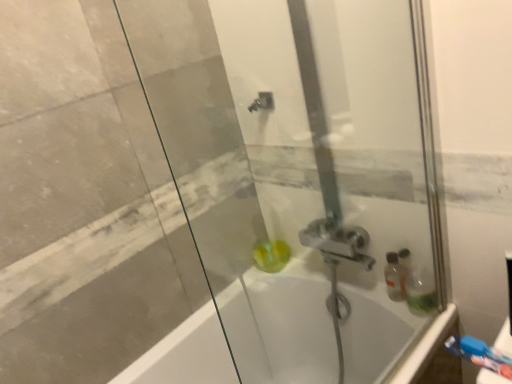
I want to click on white glossy bathtub at center, so click(185, 354).

How different are the orientations of transparent glass shower door at center and white glossy bathtub at center in degrees?

There is a 0.266-degree angle between the facing directions of transparent glass shower door at center and white glossy bathtub at center.

In terms of size, does transparent glass shower door at center appear bigger or smaller than white glossy bathtub at center?

Considering their sizes, transparent glass shower door at center takes up less space than white glossy bathtub at center.

Can you confirm if transparent glass shower door at center is thinner than white glossy bathtub at center?

Yes, transparent glass shower door at center is thinner than white glossy bathtub at center.

From a real-world perspective, is transparent glass shower door at center positioned under white glossy bathtub at center based on gravity?

No.

Is point (271, 267) closer or farther from the camera than point (196, 319)?

Point (271, 267).

Could you tell me if translucent green soap at center is turned towards white glossy bathtub at center?

No.

Is translucent green soap at center located outside white glossy bathtub at center?

Absolutely, translucent green soap at center is external to white glossy bathtub at center.

Is translucent green soap at center wider or thinner than white glossy bathtub at center?

Clearly, translucent green soap at center has less width compared to white glossy bathtub at center.

From the image's perspective, who appears lower, white glossy bathtub at center or translucent green soap at center?

From the image's view, white glossy bathtub at center is below.

From a real-world perspective, relative to translucent green soap at center, is white glossy bathtub at center vertically above or below?

Clearly, from a real-world perspective, white glossy bathtub at center is below translucent green soap at center.

Is white glossy bathtub at center shorter than translucent green soap at center?

Incorrect, the height of white glossy bathtub at center does not fall short of that of translucent green soap at center.

Is white glossy bathtub at center further to the viewer compared to translucent green soap at center?

No, white glossy bathtub at center is in front of translucent green soap at center.

Consider the image. In terms of height, does blue plastic toothbrush at lower right look taller or shorter compared to white glossy bathtub at center?

Clearly, blue plastic toothbrush at lower right is shorter compared to white glossy bathtub at center.

From a real-world perspective, is blue plastic toothbrush at lower right positioned above or below white glossy bathtub at center?

In terms of real-world spatial position, blue plastic toothbrush at lower right is above white glossy bathtub at center.

Which is in front, point (477, 363) or point (210, 363)?

The point (477, 363) is in front.

Is blue plastic toothbrush at lower right with white glossy bathtub at center?

No, blue plastic toothbrush at lower right is not beside white glossy bathtub at center.

From a real-world perspective, which object stands above the other?

From a 3D spatial view, transparent glass shower door at center is above.

Between white glossy bathtub at center and transparent glass shower door at center, which one has smaller width?

transparent glass shower door at center.

Considering the relative positions of white glossy bathtub at center and transparent glass shower door at center in the image provided, is white glossy bathtub at center to the left of transparent glass shower door at center from the viewer's perspective?

Yes, white glossy bathtub at center is to the left of transparent glass shower door at center.

Is white glossy bathtub at center positioned with its back to transparent glass shower door at center?

No, white glossy bathtub at center is not facing away from transparent glass shower door at center.

Does transparent glass shower door at center turn towards blue plastic toothbrush at lower right?

Yes, transparent glass shower door at center is aimed at blue plastic toothbrush at lower right.

Choose the correct answer: Is transparent glass shower door at center inside blue plastic toothbrush at lower right or outside it?

transparent glass shower door at center is not inside blue plastic toothbrush at lower right, it's outside.

Looking at this image, can you tell me how much transparent glass shower door at center and blue plastic toothbrush at lower right differ in facing direction?

The angular difference between transparent glass shower door at center and blue plastic toothbrush at lower right is 89.3 degrees.

Considering their positions, is transparent glass shower door at center located in front of or behind blue plastic toothbrush at lower right?

transparent glass shower door at center is in front of blue plastic toothbrush at lower right.

Between blue plastic toothbrush at lower right and translucent green soap at center, which one has smaller size?

Smaller between the two is blue plastic toothbrush at lower right.

Which object is thinner, blue plastic toothbrush at lower right or translucent green soap at center?

With smaller width is blue plastic toothbrush at lower right.

Is point (490, 358) more distant than point (277, 245)?

No, (490, 358) is closer to viewer.

I want to click on bathtub that is behind the transparent glass shower door at center, so click(x=185, y=354).

Locate an element on the screen. Image resolution: width=512 pixels, height=384 pixels. bathtub below the translucent green soap at center (from a real-world perspective) is located at coordinates (185, 354).

Looking at the image, which one is located closer to transparent glass shower door at center, white glossy bathtub at center or translucent green soap at center?

Among the two, translucent green soap at center is located nearer to transparent glass shower door at center.

Looking at the image, which one is located closer to transparent glass shower door at center, translucent green soap at center or blue plastic toothbrush at lower right?

translucent green soap at center.

Looking at the image, which one is located further to white glossy bathtub at center, transparent glass shower door at center or translucent green soap at center?

transparent glass shower door at center.

Which object lies nearer to the anchor point transparent glass shower door at center, translucent green soap at center or white glossy bathtub at center?

translucent green soap at center is closer to transparent glass shower door at center.

Estimate the real-world distances between objects in this image. Which object is further from blue plastic toothbrush at lower right, transparent glass shower door at center or translucent green soap at center?

Based on the image, translucent green soap at center appears to be further to blue plastic toothbrush at lower right.

When comparing their distances from white glossy bathtub at center, does transparent glass shower door at center or blue plastic toothbrush at lower right seem closer?

transparent glass shower door at center is closer to white glossy bathtub at center.

Which object lies further to the anchor point translucent green soap at center, transparent glass shower door at center or blue plastic toothbrush at lower right?

blue plastic toothbrush at lower right.

Estimate the real-world distances between objects in this image. Which object is closer to white glossy bathtub at center, translucent green soap at center or transparent glass shower door at center?

translucent green soap at center lies closer to white glossy bathtub at center than the other object.

You are a GUI agent. You are given a task and a screenshot of the screen. Output one action in this format:
    pyautogui.click(x=<x>, y=<y>)
    Task: Click on the bathtub positioned between transparent glass shower door at center and translucent green soap at center from near to far
    The width and height of the screenshot is (512, 384).
    Given the screenshot: What is the action you would take?
    pyautogui.click(x=185, y=354)

The image size is (512, 384). I want to click on toiletry positioned between transparent glass shower door at center and translucent green soap at center from near to far, so click(x=480, y=354).

Identify the location of toiletry between transparent glass shower door at center and white glossy bathtub at center in the up-down direction. This screenshot has height=384, width=512. (480, 354).

Locate an element on the screen. The width and height of the screenshot is (512, 384). bathtub between blue plastic toothbrush at lower right and translucent green soap at center in the front-back direction is located at coordinates pyautogui.click(x=185, y=354).